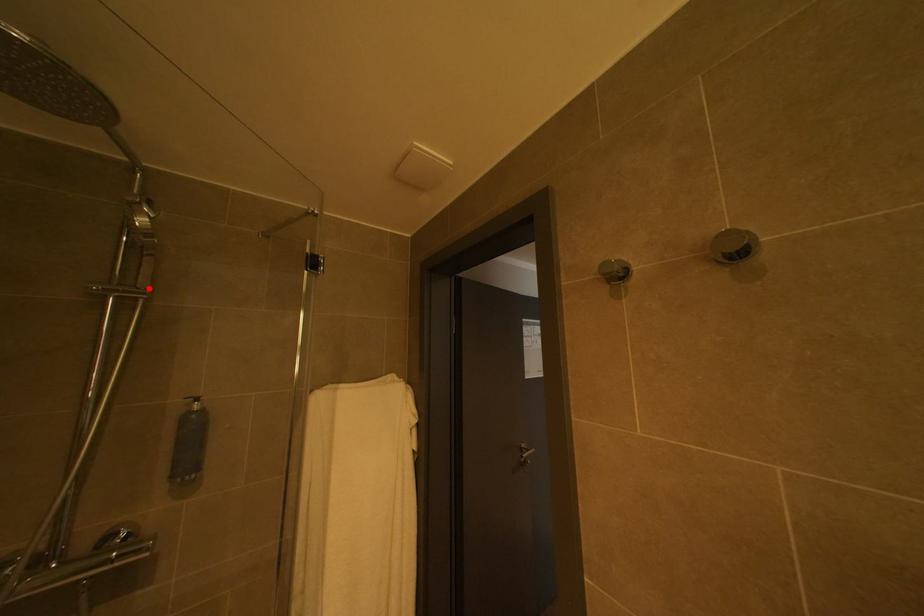
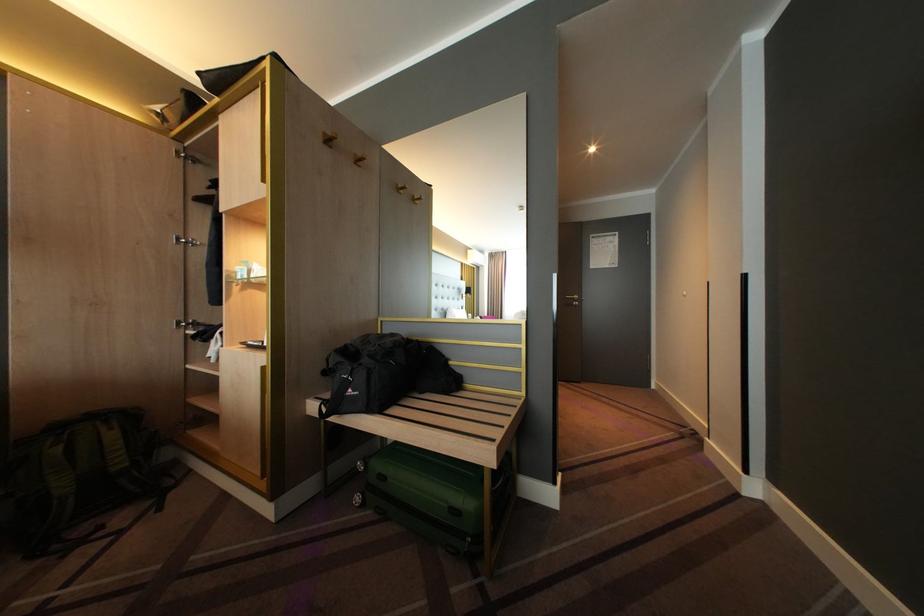
Question: I am providing you with two images of the same scene from different viewpoints. A red point is marked on the first image. Is the red point's position out of view in image 2?

Choices:
 (A) Yes
 (B) No

Answer: (A)